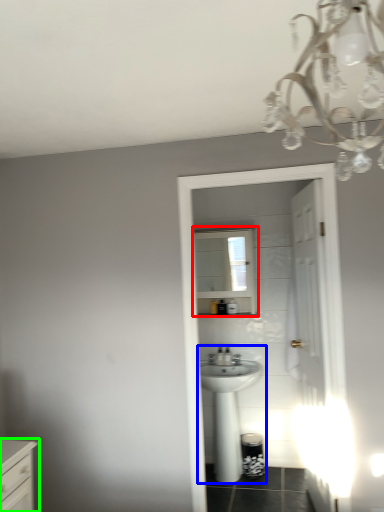
Question: Which is farther away from medicine cabinet (highlighted by a red box)? sink (highlighted by a blue box) or chest of drawers (highlighted by a green box)?

Choices:
 (A) sink
 (B) chest of drawers

Answer: (B)